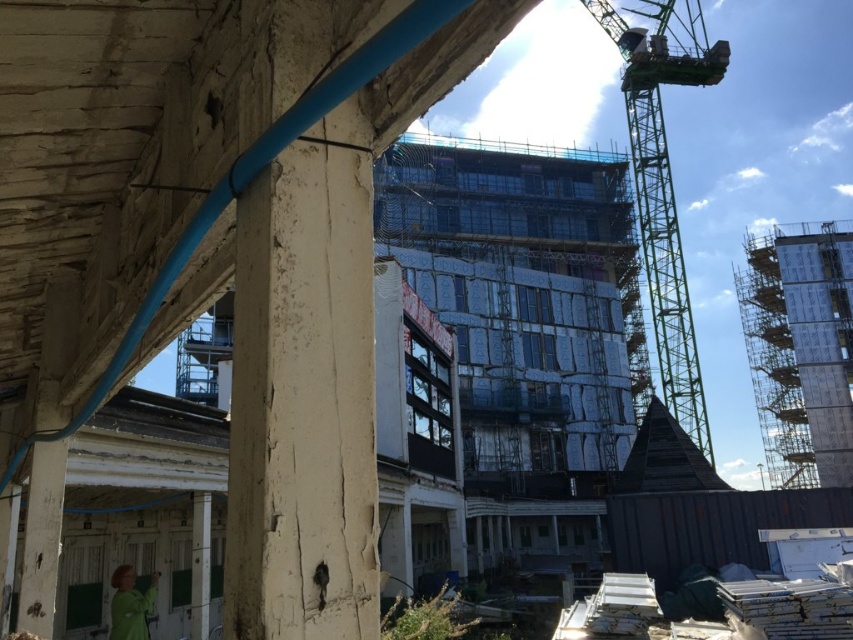
What do you see at coordinates (664, 180) in the screenshot? I see `green metallic crane at upper right` at bounding box center [664, 180].

Who is more distant from viewer, (677, 61) or (155, 577)?

Point (677, 61)

I want to click on green metallic crane at upper right, so click(x=664, y=180).